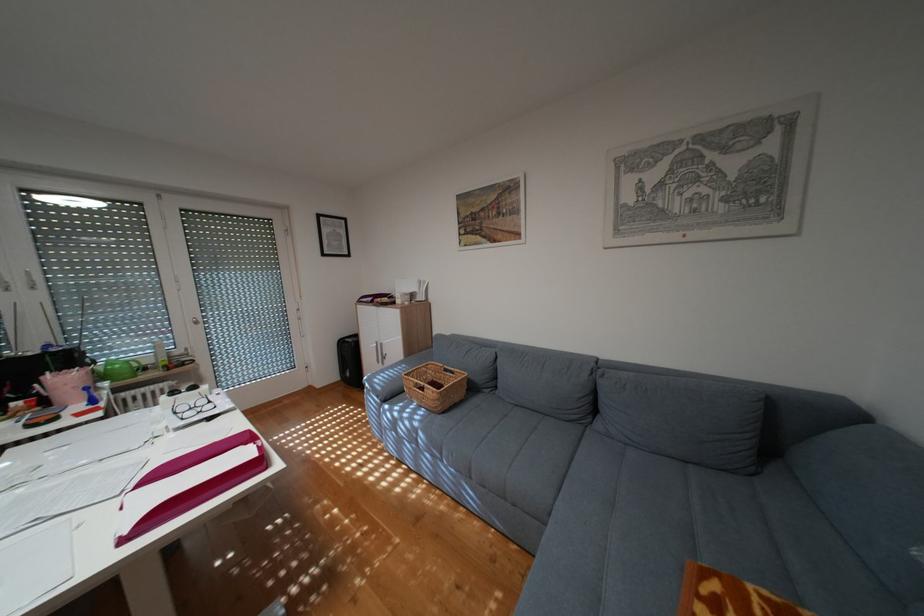
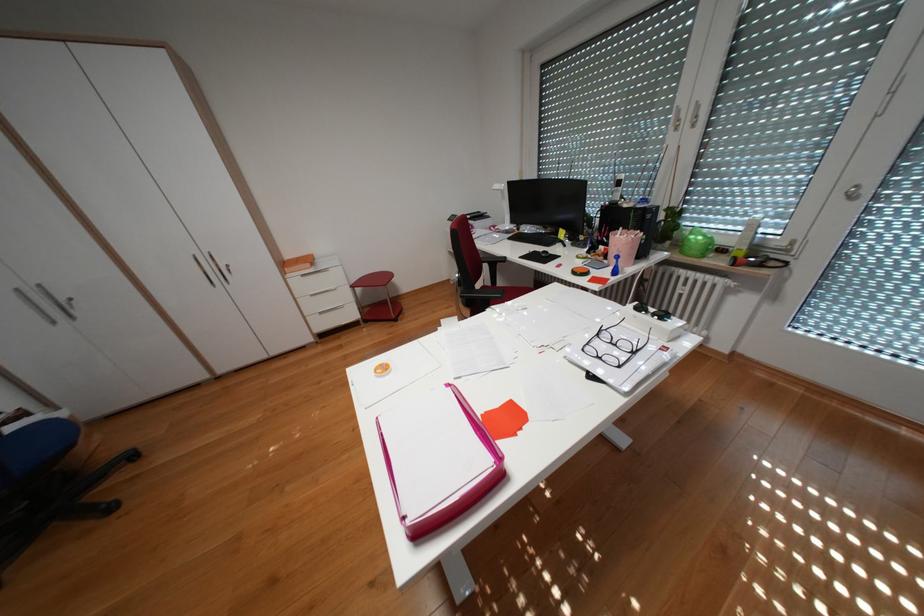
Find the pixel in the second image that matches (187,411) in the first image.

(610, 334)